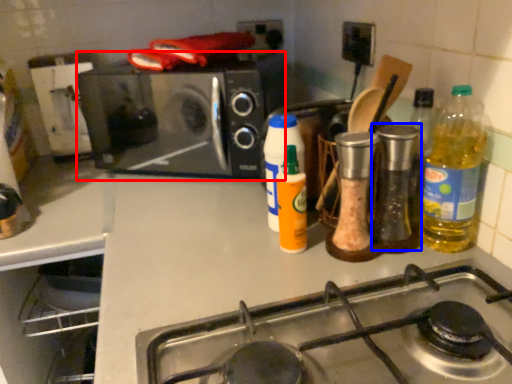
Question: Among these objects, which one is nearest to the camera, microwave oven (highlighted by a red box) or bottle (highlighted by a blue box)?

Choices:
 (A) microwave oven
 (B) bottle

Answer: (B)